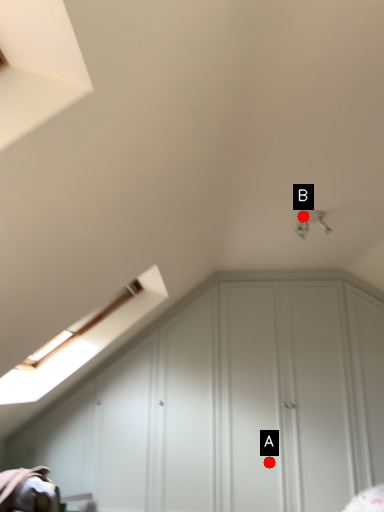
Question: Two points are circled on the image, labeled by A and B beside each circle. Which of the following is the farthest from the observer?

Choices:
 (A) A is further
 (B) B is further

Answer: (A)